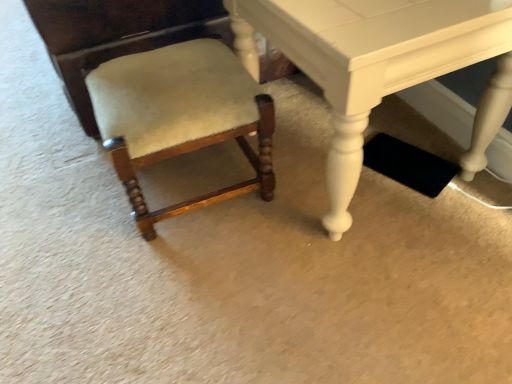
The width and height of the screenshot is (512, 384). What do you see at coordinates (180, 117) in the screenshot? I see `suede-like beige chair at lower left` at bounding box center [180, 117].

I want to click on suede-like beige chair at lower left, so click(180, 117).

Where is `matte white table at center`? The width and height of the screenshot is (512, 384). matte white table at center is located at coordinates (379, 64).

The image size is (512, 384). Describe the element at coordinates (379, 64) in the screenshot. I see `matte white table at center` at that location.

Find the location of `suede-like beige chair at lower left`. suede-like beige chair at lower left is located at coordinates (180, 117).

Based on their positions, is matte white table at center located to the left or right of suede-like beige chair at lower left?

Clearly, matte white table at center is on the right of suede-like beige chair at lower left in the image.

Is matte white table at center positioned behind suede-like beige chair at lower left?

No, matte white table at center is in front of suede-like beige chair at lower left.

Which is closer, (426, 56) or (260, 118)?

Point (426, 56).

From the image's perspective, which one is positioned higher, matte white table at center or suede-like beige chair at lower left?

matte white table at center is shown above in the image.

From a real-world perspective, who is located lower, matte white table at center or suede-like beige chair at lower left?

suede-like beige chair at lower left is physically lower.

From the picture: Between matte white table at center and suede-like beige chair at lower left, which one has smaller width?

suede-like beige chair at lower left is thinner.

Which of these two, matte white table at center or suede-like beige chair at lower left, stands shorter?

suede-like beige chair at lower left is shorter.

Considering the sizes of matte white table at center and suede-like beige chair at lower left in the image, is matte white table at center bigger or smaller than suede-like beige chair at lower left?

In the image, matte white table at center appears to be larger than suede-like beige chair at lower left.

Is suede-like beige chair at lower left a part of matte white table at center?

No.

Is matte white table at center far away from suede-like beige chair at lower left?

No, matte white table at center is not far from suede-like beige chair at lower left.

Is matte white table at center looking in the opposite direction of suede-like beige chair at lower left?

No, suede-like beige chair at lower left is not at the back of matte white table at center.

Can you tell me how much matte white table at center and suede-like beige chair at lower left differ in facing direction?

The facing directions of matte white table at center and suede-like beige chair at lower left are 4.56 degrees apart.

Where is `table on the right of suede-like beige chair at lower left`? table on the right of suede-like beige chair at lower left is located at coordinates (x=379, y=64).

Which is more to the right, suede-like beige chair at lower left or matte white table at center?

matte white table at center is more to the right.

Is suede-like beige chair at lower left positioned before matte white table at center?

No, it is not.

Between point (256, 90) and point (325, 82), which one is positioned in front?

Point (325, 82)

From the image's perspective, would you say suede-like beige chair at lower left is shown under matte white table at center?

Indeed, from the image's perspective, suede-like beige chair at lower left is shown beneath matte white table at center.

From a real-world perspective, who is located lower, suede-like beige chair at lower left or matte white table at center?

From a 3D spatial view, suede-like beige chair at lower left is below.

Can you confirm if suede-like beige chair at lower left is wider than matte white table at center?

In fact, suede-like beige chair at lower left might be narrower than matte white table at center.

Does suede-like beige chair at lower left have a lesser height compared to matte white table at center?

Yes, suede-like beige chair at lower left is shorter than matte white table at center.

Who is bigger, suede-like beige chair at lower left or matte white table at center?

Bigger between the two is matte white table at center.

Would you say matte white table at center is part of suede-like beige chair at lower left's contents?

No.

Would you say suede-like beige chair at lower left is a long distance from matte white table at center?

No, suede-like beige chair at lower left is not far away from matte white table at center.

Could you tell me if suede-like beige chair at lower left is facing matte white table at center?

No, suede-like beige chair at lower left is not aimed at matte white table at center.

What's the angular difference between suede-like beige chair at lower left and matte white table at center's facing directions?

suede-like beige chair at lower left and matte white table at center are facing 4.56 degrees away from each other.

Identify the location of table above the suede-like beige chair at lower left (from the image's perspective). (379, 64).

What are the coordinates of `chair that is under the matte white table at center (from a real-world perspective)` in the screenshot? It's located at (180, 117).

You are a GUI agent. You are given a task and a screenshot of the screen. Output one action in this format:
    pyautogui.click(x=<x>, y=<y>)
    Task: Click on the chair on the left of matte white table at center
    This screenshot has width=512, height=384.
    Given the screenshot: What is the action you would take?
    pyautogui.click(x=180, y=117)